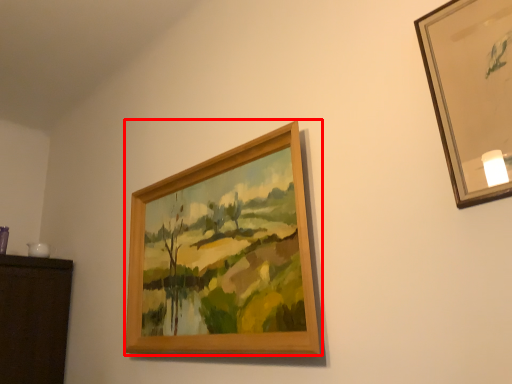
Question: Where is picture frame (annotated by the red box) located in relation to picture frame in the image?

Choices:
 (A) right
 (B) left

Answer: (B)